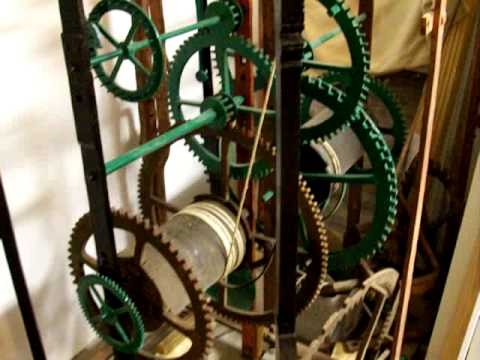
This screenshot has height=360, width=480. Identify the location of shadow on wall. (50, 201).